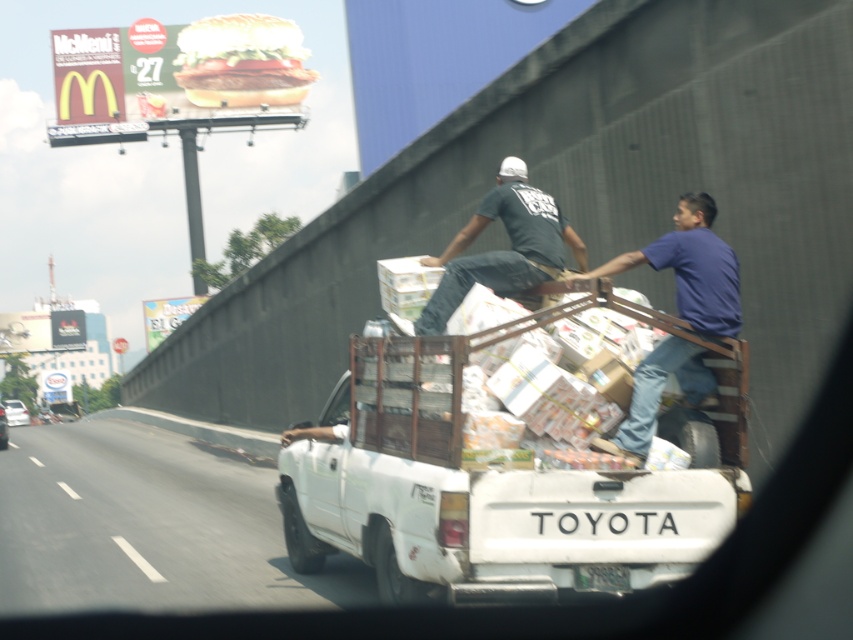
You are a passenger in a car and see the white matte truck at center and the black cotton shirt at upper center through the window. Which object is closer to the left side of the window?

The white matte truck at center is closer to the left side of the window because it is positioned to the left of the black cotton shirt at upper center.

You are a passenger in the vehicle and want to know if the white matte truck at center is close enough to the black cotton shirt at upper center to see the shirt clearly. Based on the distance between them, can you determine if the shirt would be visible to someone looking from your position?

The white matte truck at center is 1.16 meters from the black cotton shirt at upper center. Since the distance is relatively short, the black cotton shirt at upper center would likely be visible to someone looking from the passenger seat.